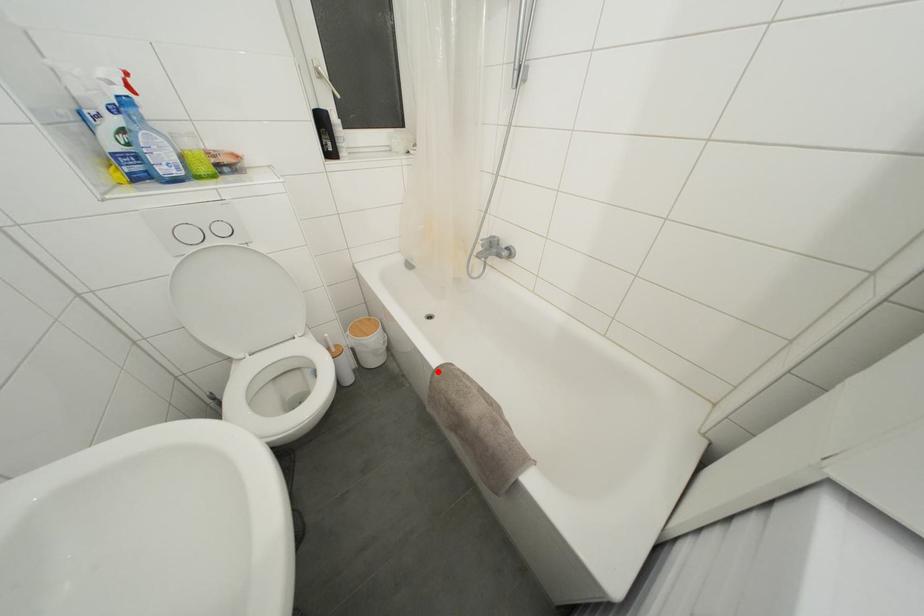
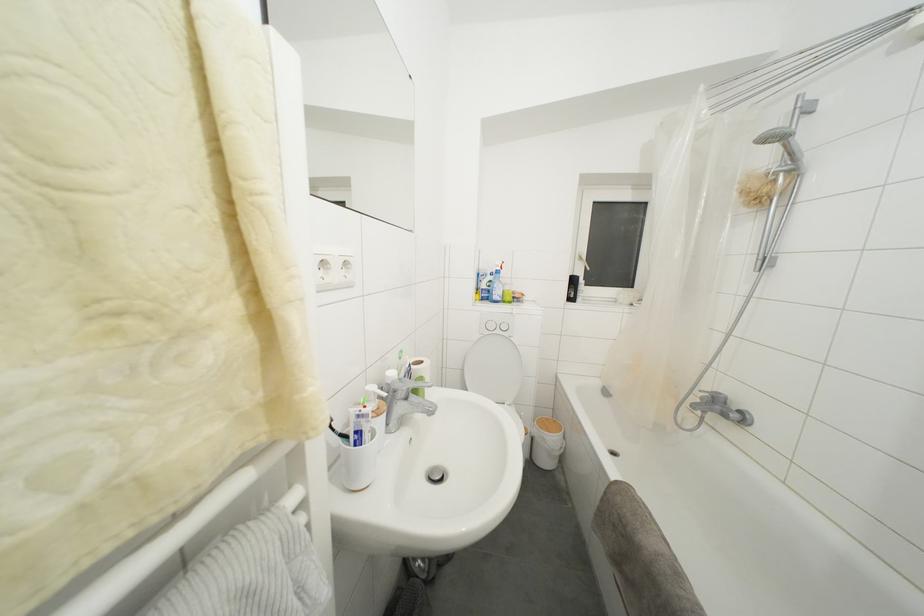
In the second image, find the point that corresponds to the highlighted location in the first image.

(617, 484)